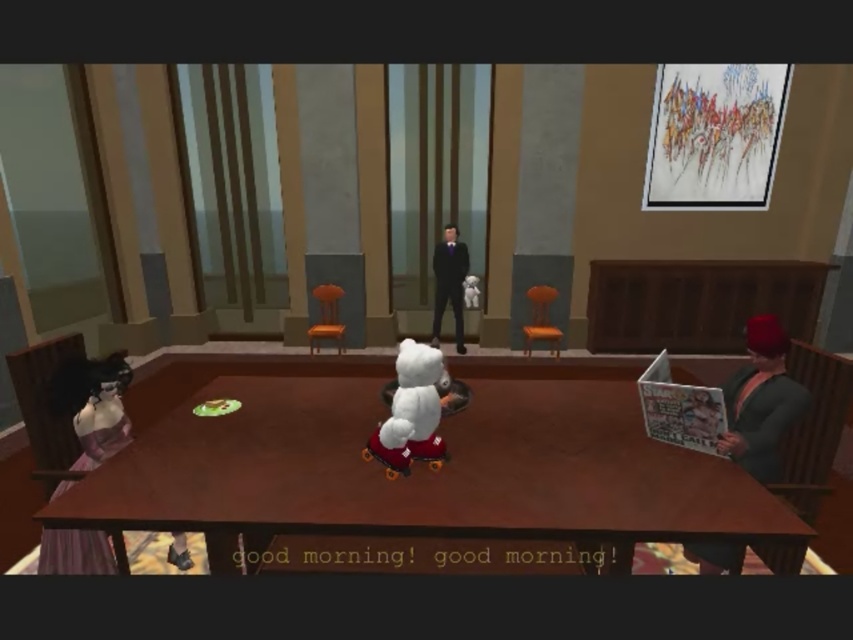
Question: Is matte purple dress at lower left smaller than wooden chair at center?

Choices:
 (A) no
 (B) yes

Answer: (B)

Question: Estimate the real-world distances between objects in this image. Which object is farther from the shiny black suit at center?

Choices:
 (A) yellow matte chair at center
 (B) wooden chair at center

Answer: (B)

Question: Which of the following is the closest to the observer?

Choices:
 (A) wooden chair at center
 (B) brown wooden table at center
 (C) shiny black suit at center
 (D) green fabric cap at right

Answer: (B)

Question: Can you confirm if matte purple dress at lower left is thinner than green fabric cap at right?

Choices:
 (A) yes
 (B) no

Answer: (A)

Question: Is brown wooden table at center to the left of green fabric cap at right from the viewer's perspective?

Choices:
 (A) yes
 (B) no

Answer: (A)

Question: Which of the following is the closest to the observer?

Choices:
 (A) (508, 486)
 (B) (537, 289)
 (C) (776, 412)
 (D) (85, 541)

Answer: (A)